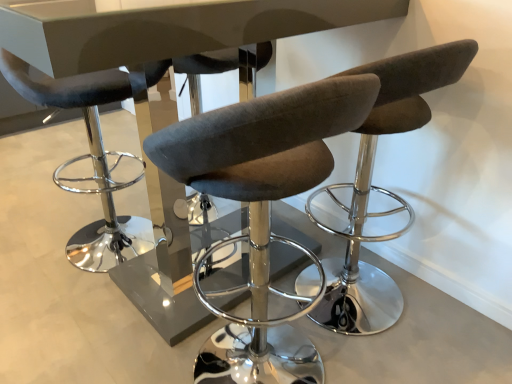
Question: From a real-world perspective, is matte black stool at left, acting as the second chair starting from the right, on top of brown fabric stool at center, which appears as the 2th chair when viewed from the left?

Choices:
 (A) yes
 (B) no

Answer: (B)

Question: Is matte black stool at left, marked as the first chair in a left-to-right arrangement, far away from brown fabric stool at center, the first chair in the right-to-left sequence?

Choices:
 (A) yes
 (B) no

Answer: (A)

Question: Is matte black stool at left, acting as the second chair starting from the right, touching brown fabric stool at center, which appears as the 2th chair when viewed from the left?

Choices:
 (A) yes
 (B) no

Answer: (B)

Question: Can you confirm if matte black stool at left, marked as the first chair in a left-to-right arrangement, is shorter than brown fabric stool at center, the first chair in the right-to-left sequence?

Choices:
 (A) yes
 (B) no

Answer: (A)

Question: Is matte black stool at left, marked as the first chair in a left-to-right arrangement, positioned beyond the bounds of brown fabric stool at center, the first chair in the right-to-left sequence?

Choices:
 (A) no
 (B) yes

Answer: (B)

Question: Considering the positions of point (359, 319) and point (108, 259), is point (359, 319) closer or farther from the camera than point (108, 259)?

Choices:
 (A) closer
 (B) farther

Answer: (A)

Question: Is brown fabric stool at center, the first chair in the right-to-left sequence, inside the boundaries of matte black stool at left, marked as the first chair in a left-to-right arrangement, or outside?

Choices:
 (A) inside
 (B) outside

Answer: (B)

Question: From their relative heights in the image, would you say brown fabric stool at center, the first chair in the right-to-left sequence, is taller or shorter than matte black stool at left, acting as the second chair starting from the right?

Choices:
 (A) short
 (B) tall

Answer: (B)

Question: From a real-world perspective, is brown fabric stool at center, the first chair in the right-to-left sequence, physically located above or below matte black stool at left, acting as the second chair starting from the right?

Choices:
 (A) above
 (B) below

Answer: (A)

Question: Which is correct: glossy white table at center is inside brown fabric stool at center, which appears as the 2th chair when viewed from the left, or outside of it?

Choices:
 (A) outside
 (B) inside

Answer: (A)

Question: In the image, is glossy white table at center on the left side or the right side of brown fabric stool at center, the first chair in the right-to-left sequence?

Choices:
 (A) left
 (B) right

Answer: (A)

Question: Is glossy white table at center in front of or behind brown fabric stool at center, the first chair in the right-to-left sequence, in the image?

Choices:
 (A) behind
 (B) front

Answer: (B)

Question: From the image's perspective, is glossy white table at center above or below brown fabric stool at center, which appears as the 2th chair when viewed from the left?

Choices:
 (A) above
 (B) below

Answer: (A)

Question: Do you think glossy white table at center is within matte black stool at left, marked as the first chair in a left-to-right arrangement, or outside of it?

Choices:
 (A) inside
 (B) outside

Answer: (B)

Question: In terms of width, does glossy white table at center look wider or thinner when compared to matte black stool at left, marked as the first chair in a left-to-right arrangement?

Choices:
 (A) thin
 (B) wide

Answer: (B)